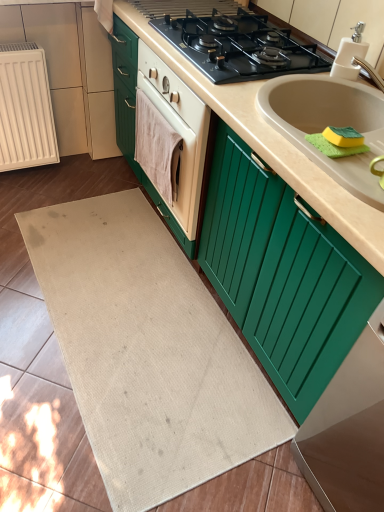
Question: Is point (142, 203) closer or farther from the camera than point (246, 130)?

Choices:
 (A) closer
 (B) farther

Answer: (B)

Question: In the image, is beige fabric bath mat at center positioned in front of or behind beige matte countertop at center?

Choices:
 (A) behind
 (B) front

Answer: (A)

Question: Which of these objects is positioned farthest from the beige matte countertop at center?

Choices:
 (A) black matte gas stove at upper center
 (B) yellow-green sponge at sink right
 (C) white ribbed radiator at left
 (D) beige fabric bath mat at center
 (E) pink fabric hand towel at center

Answer: (D)

Question: Which of these objects is positioned farthest from the beige matte countertop at center?

Choices:
 (A) pink fabric hand towel at center
 (B) green matte cabinet at lower right
 (C) yellow-green sponge at sink right
 (D) black matte gas stove at upper center
 (E) white ribbed radiator at left

Answer: (E)